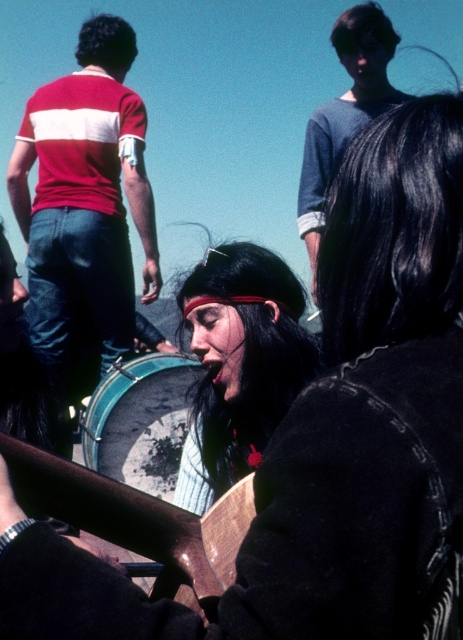
This screenshot has width=463, height=640. I want to click on blue metallic drum at center, so click(141, 420).

Can you confirm if blue metallic drum at center is positioned to the left of blue sweater at upper center?

Correct, you'll find blue metallic drum at center to the left of blue sweater at upper center.

Which is in front, point (125, 412) or point (339, 60)?

Point (125, 412) is in front.

This screenshot has height=640, width=463. What are the coordinates of `blue metallic drum at center` in the screenshot? It's located at (141, 420).

Is wooden book at center bigger than blue sweater at upper center?

Actually, wooden book at center might be smaller than blue sweater at upper center.

Is point (195, 540) positioned behind point (341, 97)?

No, (195, 540) is in front of (341, 97).

Is point (68, 467) farther from camera compared to point (327, 141)?

No, (68, 467) is closer to viewer.

Image resolution: width=463 pixels, height=640 pixels. Identify the location of wooden book at center. (137, 516).

Based on the photo, is red striped t-shirt at left thinner than wooden book at center?

Incorrect, red striped t-shirt at left's width is not less than wooden book at center's.

Locate an element on the screen. red striped t-shirt at left is located at coordinates (86, 196).